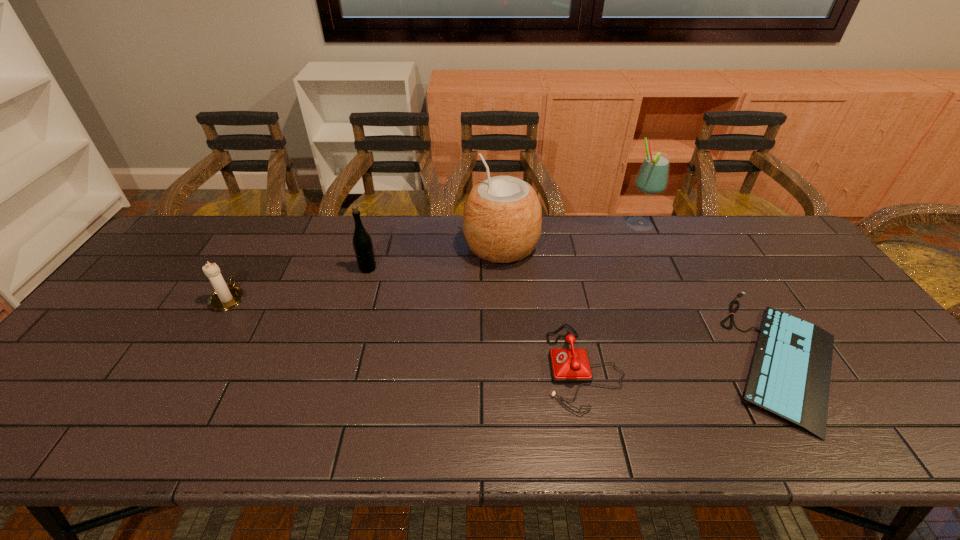
Image resolution: width=960 pixels, height=540 pixels. Find the location of `alcohol`. alcohol is located at coordinates (652, 177).

Where is `coconut`? This screenshot has width=960, height=540. coconut is located at coordinates (502, 217).

Find the location of `beer bottle`. beer bottle is located at coordinates (362, 243).

Locate an element on the screen. This screenshot has width=960, height=540. the fifth object from right to left is located at coordinates (362, 243).

Locate an element on the screen. candle holder is located at coordinates (224, 298).

Identify the location of the fourth tallest object. The height and width of the screenshot is (540, 960). [x=224, y=298].

In order to click on telephone in this screenshot , I will do `click(568, 365)`.

You are a GUI agent. You are given a task and a screenshot of the screen. Output one action in this format:
    pyautogui.click(x=<x>, y=<y>)
    Task: Click on the computer keyboard
    The width and height of the screenshot is (960, 540).
    Given the screenshot: What is the action you would take?
    [x=789, y=378]

Find the location of a particular element. Image resolution: width=960 pixels, height=540 pixels. vacant area situated on the right of the alcohol is located at coordinates (749, 225).

Find the location of a particular element. vacant space positioned 0.340m on the front of the coconut is located at coordinates (508, 364).